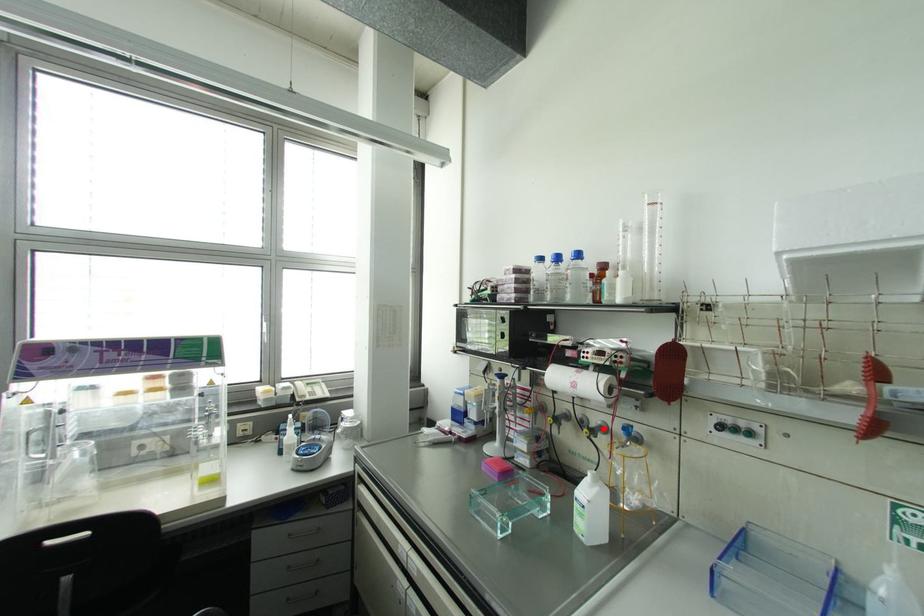
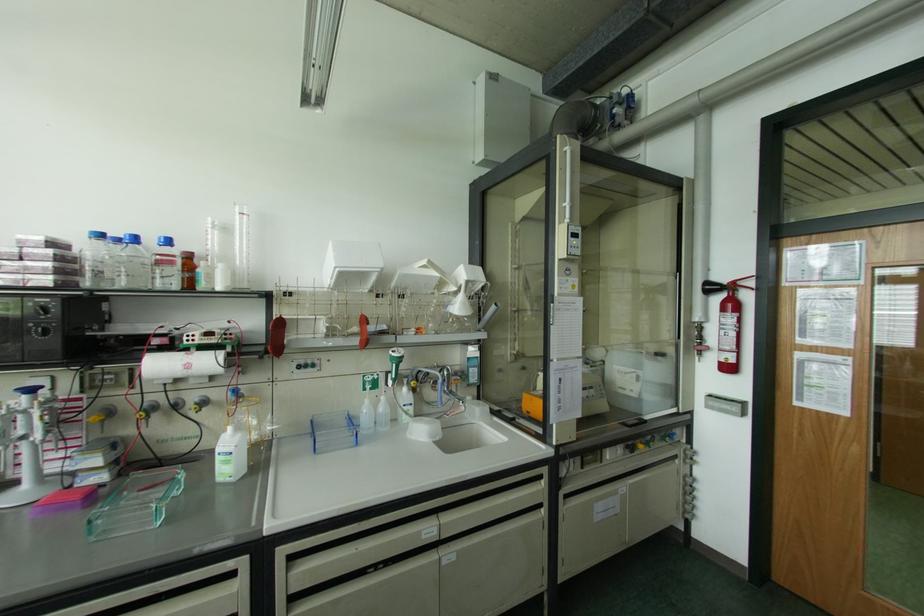
In the second image, find the point that corresponds to the highlighted location in the first image.

(203, 402)